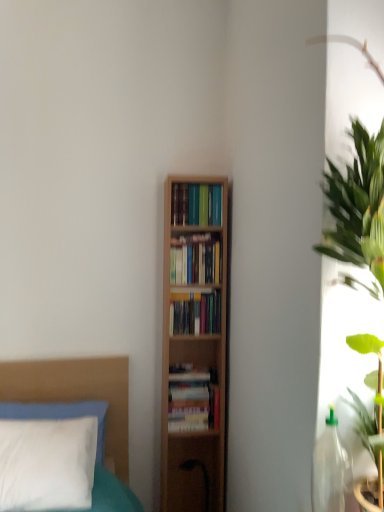
Image resolution: width=384 pixels, height=512 pixels. Find the location of `free space above hardcover books at center, which is the 1th book in top-to-bottom order (from a real-world perspective)`. free space above hardcover books at center, which is the 1th book in top-to-bottom order (from a real-world perspective) is located at coordinates (199, 184).